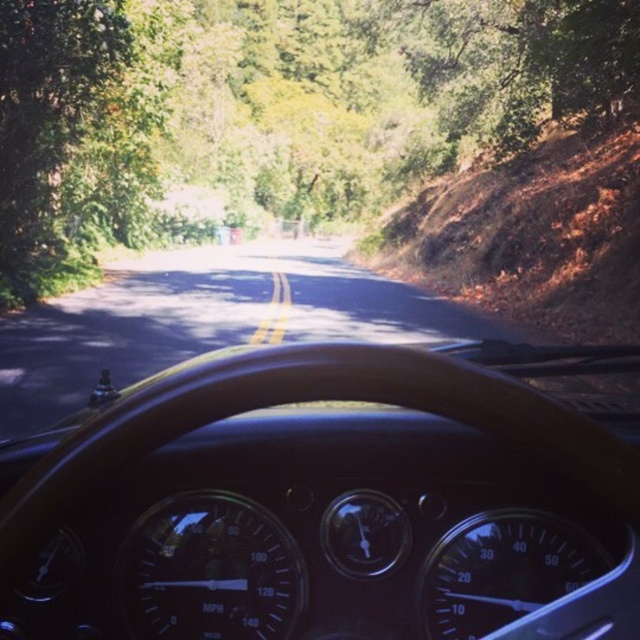
Is point (602, 516) closer to viewer compared to point (456, 332)?

Yes, point (602, 516) is closer to viewer.

Is black leather steering wheel at center further to the viewer compared to asphalt road at center?

No, it is in front of asphalt road at center.

Is point (518, 419) farther from camera compared to point (45, 339)?

No, it is in front of (45, 339).

You are a GUI agent. You are given a task and a screenshot of the screen. Output one action in this format:
    pyautogui.click(x=<x>, y=<y>)
    Task: Click on the black leather steering wheel at center
    This screenshot has height=640, width=640.
    Given the screenshot: What is the action you would take?
    pyautogui.click(x=333, y=500)

Is green leafy tree at center thinner than asphalt road at center?

Incorrect, green leafy tree at center's width is not less than asphalt road at center's.

Between green leafy tree at center and asphalt road at center, which one is positioned higher?

green leafy tree at center

Locate an element on the screen. green leafy tree at center is located at coordinates (272, 108).

The image size is (640, 640). What are the coordinates of `green leafy tree at center` in the screenshot? It's located at (272, 108).

Is black leather steering wheel at center thinner than green leafy tree at center?

Yes.

Measure the distance between black leather steering wheel at center and green leafy tree at center.

122.55 feet

Where is `black leather steering wheel at center`? The height and width of the screenshot is (640, 640). black leather steering wheel at center is located at coordinates (333, 500).

The height and width of the screenshot is (640, 640). I want to click on black leather steering wheel at center, so click(x=333, y=500).